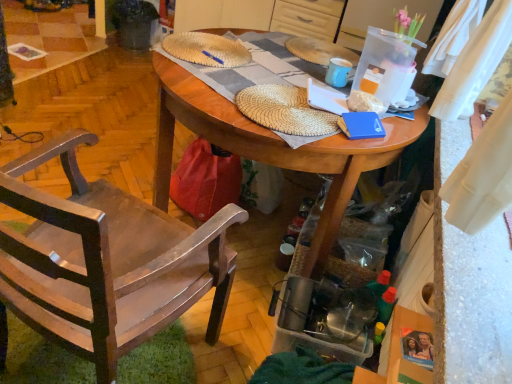
Question: Which direction should I rotate to look at woven straw hat at center, the first hat when ordered from front to back?

Choices:
 (A) left
 (B) right

Answer: (B)

Question: Is woven straw hat at upper center, which is the 2th hat in bottom-to-top order, aimed at wooden table at center?

Choices:
 (A) yes
 (B) no

Answer: (A)

Question: Is woven straw hat at upper center, which is the 2th hat in bottom-to-top order, far away from wooden table at center?

Choices:
 (A) no
 (B) yes

Answer: (A)

Question: Is woven straw hat at upper center, which is the 2th hat in bottom-to-top order, taller than wooden table at center?

Choices:
 (A) no
 (B) yes

Answer: (A)

Question: From a real-world perspective, is woven straw hat at upper center, marked as the second hat in a front-to-back arrangement, physically below wooden table at center?

Choices:
 (A) no
 (B) yes

Answer: (A)

Question: From a real-world perspective, does woven straw hat at upper center, which is the 2th hat in bottom-to-top order, stand above wooden table at center?

Choices:
 (A) no
 (B) yes

Answer: (B)

Question: Is woven straw hat at upper center, the first hat from the back, completely or partially outside of wooden table at center?

Choices:
 (A) yes
 (B) no

Answer: (B)

Question: Does woven straw hat at center, which is the second hat in top-to-bottom order, have a larger size compared to dark gray plastic trash can at upper left?

Choices:
 (A) no
 (B) yes

Answer: (A)

Question: Is woven straw hat at center, which is the second hat in top-to-bottom order, wider than dark gray plastic trash can at upper left?

Choices:
 (A) yes
 (B) no

Answer: (A)

Question: Considering the relative sizes of woven straw hat at center, which is the second hat from back to front, and dark gray plastic trash can at upper left in the image provided, is woven straw hat at center, which is the second hat from back to front, smaller than dark gray plastic trash can at upper left?

Choices:
 (A) no
 (B) yes

Answer: (B)

Question: Is woven straw hat at center, which is the 1th hat from bottom to top, positioned with its back to dark gray plastic trash can at upper left?

Choices:
 (A) no
 (B) yes

Answer: (A)

Question: From a real-world perspective, is woven straw hat at center, which is the second hat from back to front, physically below dark gray plastic trash can at upper left?

Choices:
 (A) yes
 (B) no

Answer: (B)

Question: Is woven straw hat at center, which is the second hat from back to front, with dark gray plastic trash can at upper left?

Choices:
 (A) no
 (B) yes

Answer: (A)

Question: Is dark gray plastic trash can at upper left at the right side of blue matte book at center?

Choices:
 (A) yes
 (B) no

Answer: (B)